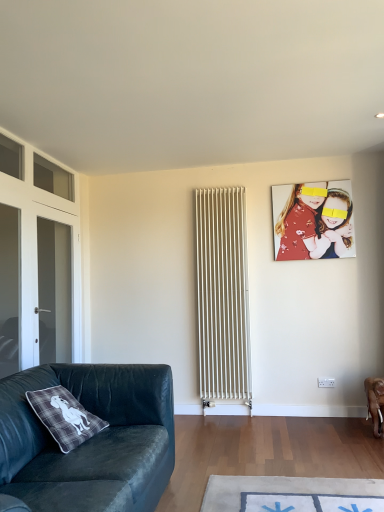
You are a GUI agent. You are given a task and a screenshot of the screen. Output one action in this format:
    pyautogui.click(x=<x>, y=<y>)
    Task: Click on the vacant area on top of matte red shirt at upper right (from a real-world perspective)
    This screenshot has height=512, width=384.
    Given the screenshot: What is the action you would take?
    pyautogui.click(x=309, y=182)